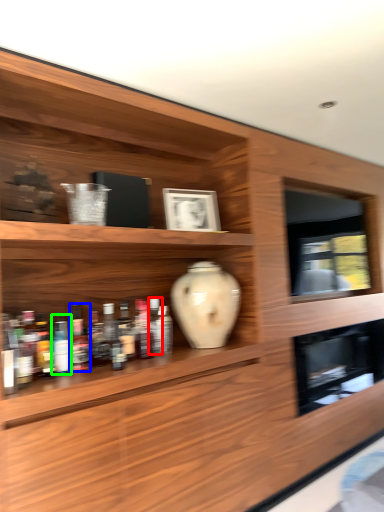
Question: Estimate the real-world distances between objects in this image. Which object is closer to bottle (highlighted by a red box), bottle (highlighted by a blue box) or bottle (highlighted by a green box)?

Choices:
 (A) bottle
 (B) bottle

Answer: (A)